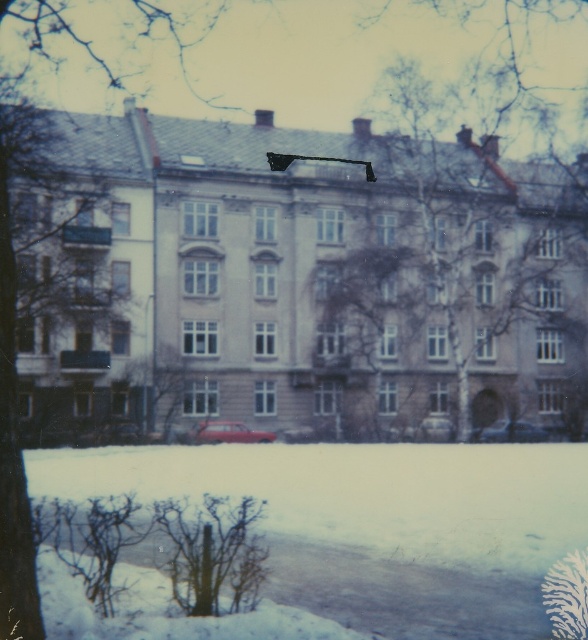
Question: Based on their relative distances, which object is nearer to the brown textured tree at center?

Choices:
 (A) white powdery snow at lower center
 (B) matte red car at center
 (C) matte red car at lower center

Answer: (C)

Question: Does white powdery snow at lower center have a larger size compared to brown textured tree at center?

Choices:
 (A) yes
 (B) no

Answer: (A)

Question: Is matte red car at center below matte red car at lower center?

Choices:
 (A) yes
 (B) no

Answer: (B)

Question: Among these objects, which one is nearest to the camera?

Choices:
 (A) white powdery snow at lower center
 (B) matte red car at lower center
 (C) brown textured tree at center
 (D) matte red car at center

Answer: (A)

Question: Which point is farther from the camera taking this photo?

Choices:
 (A) (412, 419)
 (B) (516, 428)
 (C) (239, 428)
 (D) (51, 460)

Answer: (A)

Question: Does brown textured tree at center have a greater width compared to matte red car at center?

Choices:
 (A) no
 (B) yes

Answer: (B)